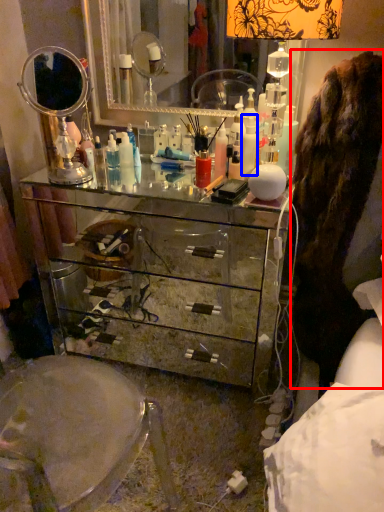
Question: Which of the following is the closest to the observer, fur coat (highlighted by a red box) or toiletry (highlighted by a blue box)?

Choices:
 (A) fur coat
 (B) toiletry

Answer: (A)